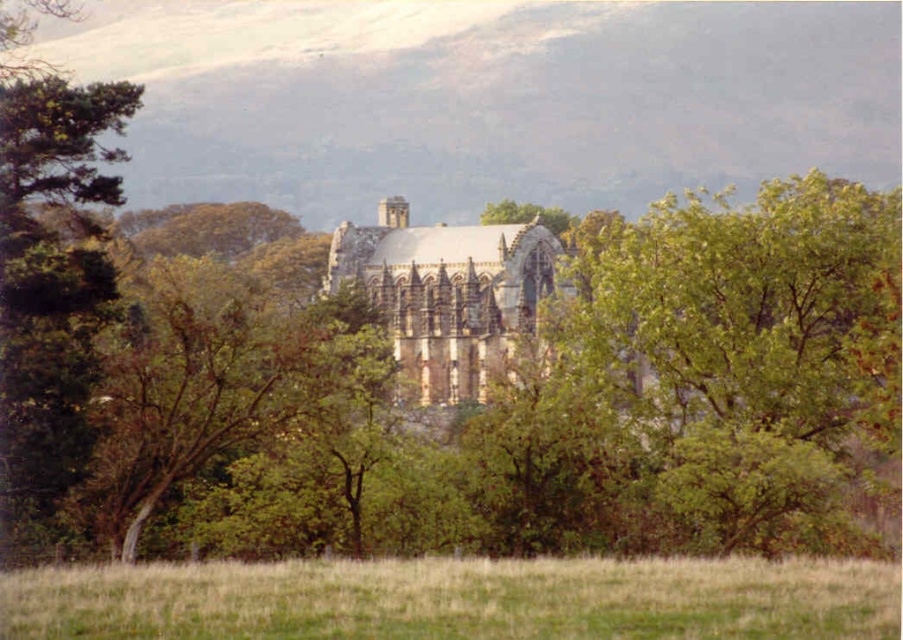
You are standing in the grassy field in front of the Gothic ruins. You want to walk to the base of the green leafy tree at center. Is the green grass at lower center between you and the tree?

The green grass at lower center is behind the green leafy tree at center, so it is not between you and the tree. You can walk directly to the tree without stepping on the green grass at lower center.

You are standing at the edge of the grassy field in the scene. If you face the Gothic ruins, where would you find the green leafy tree at center?

The green leafy tree at center is located at the center of the image, positioned at coordinates approximately 0.537 on the x axis and 0.825 on the y axis.

Looking at this image, you are an environmental scientist assessing the landscape. You notice the green leafy tree at center and the green grass at lower center. Which of these two has a greater visual impact in terms of size?

The green leafy tree at center has a larger size compared to the green grass at lower center, making it more visually impactful in terms of size.